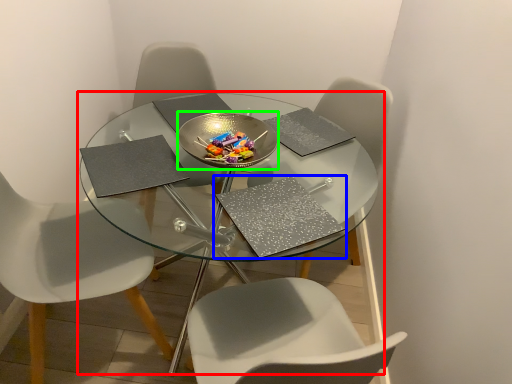
Question: Which is nearer to the table (highlighted by a red box)? pad (highlighted by a blue box) or glass plate (highlighted by a green box).

Choices:
 (A) pad
 (B) glass plate

Answer: (B)